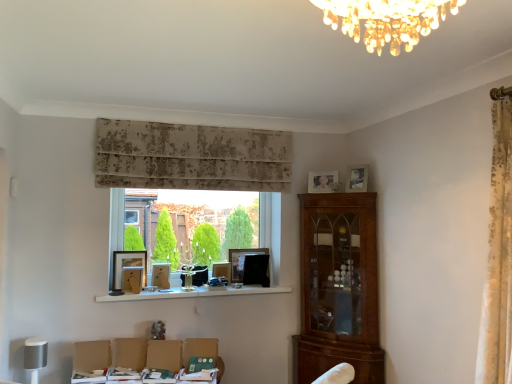
Question: Is matte black picture frame at window sill, arranged as the sixth picture frame when viewed from the right, positioned before white glossy shelf at center?

Choices:
 (A) yes
 (B) no

Answer: (B)

Question: Does matte black picture frame at window sill, arranged as the sixth picture frame when viewed from the right, lie behind white glossy shelf at center?

Choices:
 (A) yes
 (B) no

Answer: (A)

Question: Can you confirm if matte black picture frame at window sill, positioned as the 1th picture frame in left-to-right order, is bigger than white glossy shelf at center?

Choices:
 (A) no
 (B) yes

Answer: (A)

Question: Is matte black picture frame at window sill, arranged as the sixth picture frame when viewed from the right, shorter than white glossy shelf at center?

Choices:
 (A) no
 (B) yes

Answer: (A)

Question: From the image's perspective, is matte black picture frame at window sill, arranged as the sixth picture frame when viewed from the right, under white glossy shelf at center?

Choices:
 (A) yes
 (B) no

Answer: (B)

Question: Considering the relative positions of matte black picture frame at window sill, arranged as the sixth picture frame when viewed from the right, and white glossy shelf at center in the image provided, is matte black picture frame at window sill, arranged as the sixth picture frame when viewed from the right, to the left of white glossy shelf at center from the viewer's perspective?

Choices:
 (A) no
 (B) yes

Answer: (B)

Question: From the image's perspective, does white glossy shelf at center appear lower than matte black picture frame at center, acting as the 4th picture frame starting from the left?

Choices:
 (A) no
 (B) yes

Answer: (B)

Question: Is white glossy shelf at center smaller than matte black picture frame at center, which appears as the 3th picture frame when viewed from the right?

Choices:
 (A) yes
 (B) no

Answer: (B)

Question: Can we say white glossy shelf at center lies outside matte black picture frame at center, which appears as the 3th picture frame when viewed from the right?

Choices:
 (A) no
 (B) yes

Answer: (B)

Question: From the image's perspective, is white glossy shelf at center above matte black picture frame at center, which appears as the 3th picture frame when viewed from the right?

Choices:
 (A) yes
 (B) no

Answer: (B)

Question: Is white glossy shelf at center to the right of matte black picture frame at center, which appears as the 3th picture frame when viewed from the right, from the viewer's perspective?

Choices:
 (A) yes
 (B) no

Answer: (B)

Question: From a real-world perspective, is white glossy shelf at center located higher than matte black picture frame at center, which appears as the 3th picture frame when viewed from the right?

Choices:
 (A) no
 (B) yes

Answer: (A)

Question: Does matte black picture frame at center, which appears as the 3th picture frame when viewed from the right, have a lesser height compared to matte wooden picture frame at center, acting as the 5th picture frame starting from the right?

Choices:
 (A) yes
 (B) no

Answer: (B)